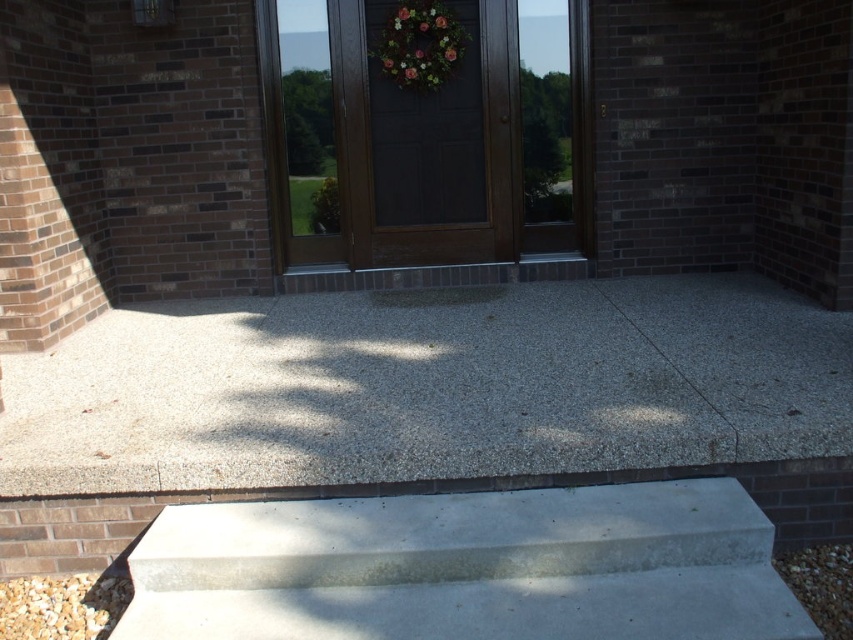
Question: Is smooth concrete step at center positioned behind brown wooden door at center?

Choices:
 (A) yes
 (B) no

Answer: (B)

Question: Is brown wooden door at center to the left of dark wood door at center from the viewer's perspective?

Choices:
 (A) no
 (B) yes

Answer: (A)

Question: Which object is farther from the camera taking this photo?

Choices:
 (A) brown wooden door at center
 (B) smooth concrete step at center

Answer: (A)

Question: Does smooth concrete step at center appear under dark wood door at center?

Choices:
 (A) no
 (B) yes

Answer: (B)

Question: Which point is farther to the camera?

Choices:
 (A) (354, 193)
 (B) (412, 35)

Answer: (A)

Question: Among these objects, which one is farthest from the camera?

Choices:
 (A) smooth concrete step at center
 (B) brown wooden door at center
 (C) dark wood door at center
 (D) green leafy wreath at center

Answer: (C)